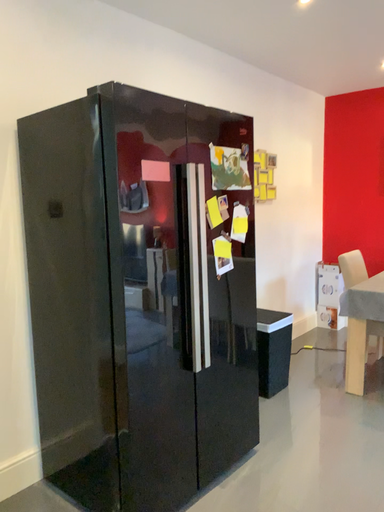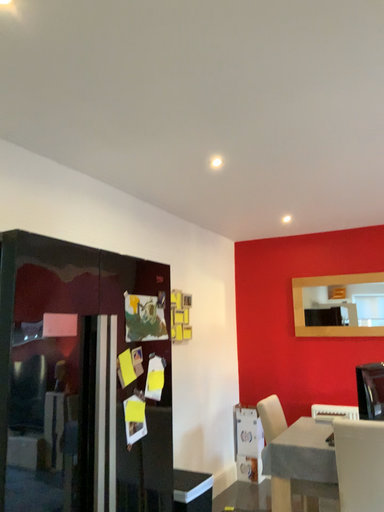
Question: How did the camera likely rotate when shooting the video?

Choices:
 (A) rotated right
 (B) rotated left

Answer: (A)